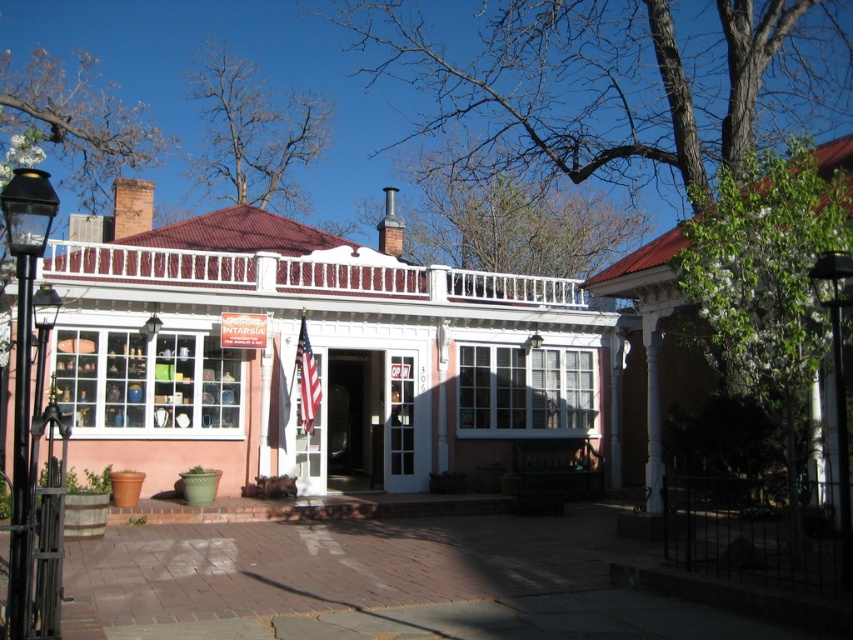
You are standing in front of the building and want to enter through the main entrance. Which object is closer to the entrance, the white painted wood porch at center or the black metal lamp post at left?

The white painted wood porch at center is closer to the entrance because it is above the black metal lamp post at left, meaning it is positioned higher up near the entrance area.